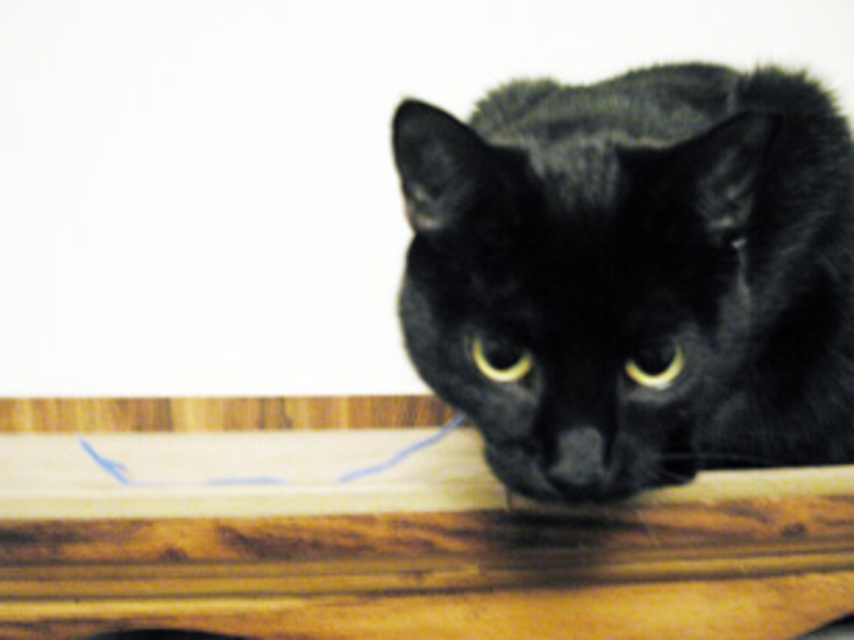
Question: Is black fur cat at center wider than wooden table at center?

Choices:
 (A) yes
 (B) no

Answer: (B)

Question: Which point is farther to the camera?

Choices:
 (A) black fur cat at center
 (B) wooden table at center

Answer: (B)

Question: Which of the following is the closest to the observer?

Choices:
 (A) (436, 321)
 (B) (363, 490)

Answer: (A)

Question: Which object appears closest to the camera in this image?

Choices:
 (A) black fur cat at center
 (B) wooden table at center

Answer: (A)

Question: Observing the image, what is the correct spatial positioning of black fur cat at center in reference to wooden table at center?

Choices:
 (A) above
 (B) below

Answer: (A)

Question: Does black fur cat at center have a lesser width compared to wooden table at center?

Choices:
 (A) no
 (B) yes

Answer: (B)